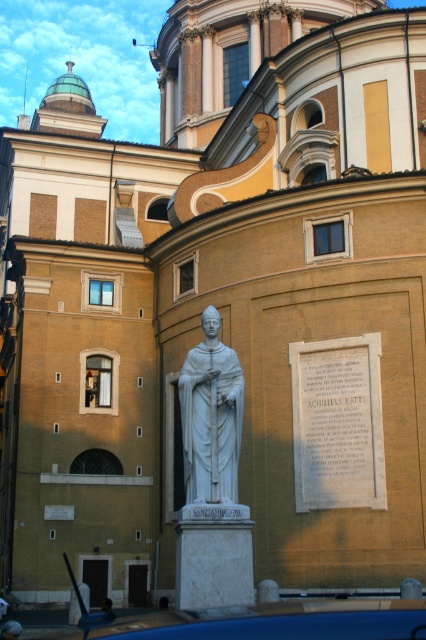
Is point (380, 605) positioned behind point (201, 452)?

No.

From the picture: Is blue matte car at lower center bigger than white marble statue at center?

Yes.

Which is in front, point (293, 632) or point (227, 424)?

Positioned in front is point (293, 632).

Locate an element on the screen. The height and width of the screenshot is (640, 426). blue matte car at lower center is located at coordinates pos(279,621).